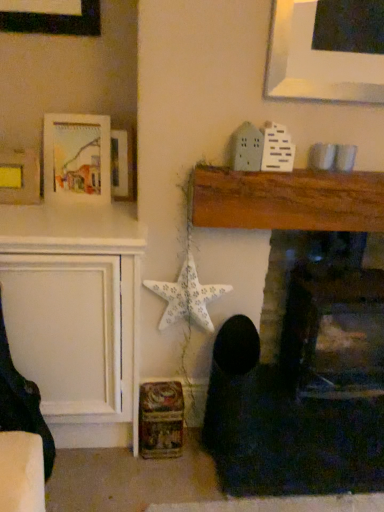
Question: From the image's perspective, relative to white paper star at center-left, is wooden picture frame at upper left, the 1th picture frame from the right, above or below?

Choices:
 (A) below
 (B) above

Answer: (B)

Question: In terms of width, does wooden picture frame at upper left, which is the third picture frame in left-to-right order, look wider or thinner when compared to white paper star at center-left?

Choices:
 (A) thin
 (B) wide

Answer: (A)

Question: Which object is positioned closest to the wooden fireplace at center, the 1th fireplace positioned from the left?

Choices:
 (A) matte yellow paper at upper left, which ranks as the third picture frame in right-to-left order
 (B) wooden picture frame at upper left, the 1th picture frame from the right
 (C) smooth stone fireplace at center, which is the second fireplace in left-to-right order
 (D) white paper star at center-left
 (E) dark fabric rocking chair at left

Answer: (C)

Question: Which object is positioned closest to the matte white picture frame at upper left, marked as the 2th picture frame in a left-to-right arrangement?

Choices:
 (A) dark fabric rocking chair at left
 (B) smooth stone fireplace at center, which appears as the 1th fireplace when viewed from the right
 (C) matte yellow paper at upper left, which ranks as the third picture frame in right-to-left order
 (D) wooden picture frame at upper left, the 1th picture frame from the right
 (E) white paper star at center-left

Answer: (D)